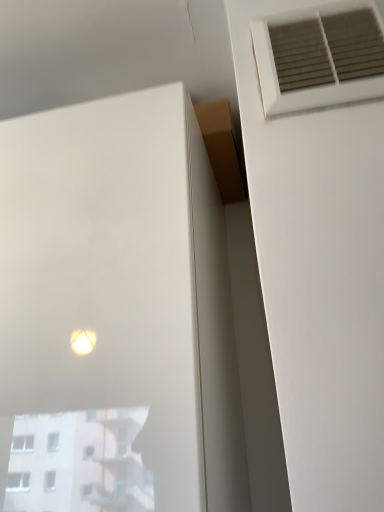
What do you see at coordinates (314, 59) in the screenshot? I see `white textured vent at upper right` at bounding box center [314, 59].

Locate an element on the screen. Image resolution: width=384 pixels, height=512 pixels. white textured vent at upper right is located at coordinates (314, 59).

Measure the distance between point [322,10] and camera.

Point [322,10] is 53.50 centimeters away from camera.

Identify the location of white textured vent at upper right. (314, 59).